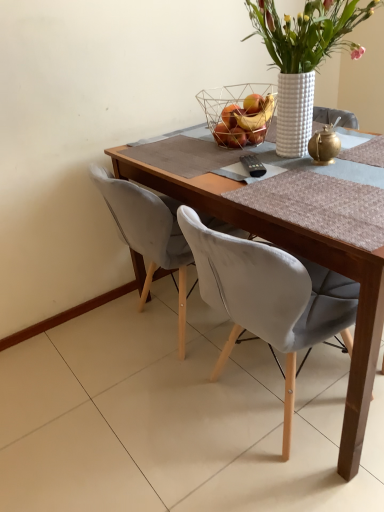
I want to click on vacant area to the left of gold metallic teapot at upper right, so click(x=276, y=174).